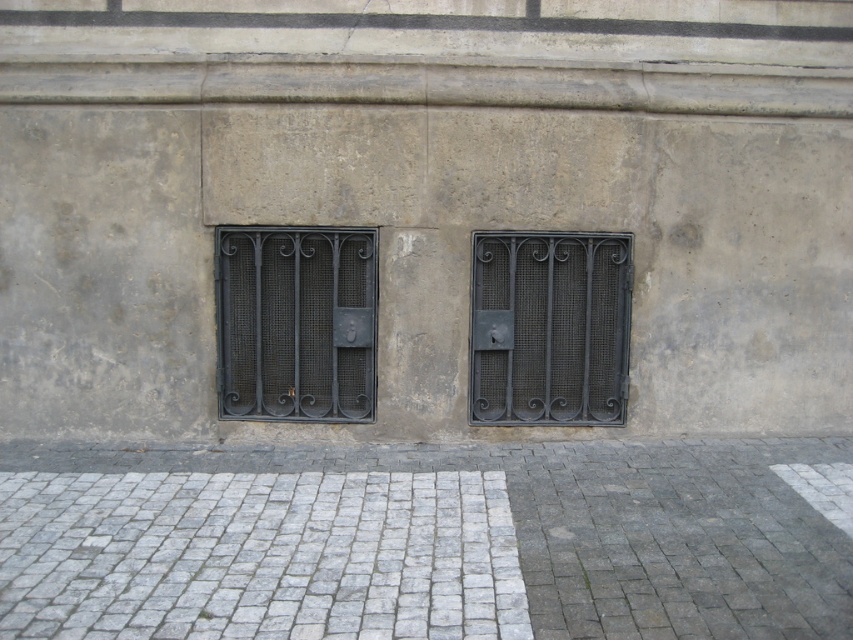
Between black wrought iron grill at center and black wrought iron window at center, which one has more height?

black wrought iron window at center

Which is behind, point (490, 420) or point (264, 349)?

Point (490, 420)

Who is more forward, (x=535, y=369) or (x=296, y=406)?

Point (x=296, y=406) is more forward.

The width and height of the screenshot is (853, 640). I want to click on black wrought iron grill at center, so click(549, 326).

Between gray cobblestone pavement at center and black wrought iron window at center, which one is positioned higher?

black wrought iron window at center is above.

Is gray cobblestone pavement at center above black wrought iron window at center?

No, gray cobblestone pavement at center is not above black wrought iron window at center.

Where is `gray cobblestone pavement at center`? Image resolution: width=853 pixels, height=640 pixels. gray cobblestone pavement at center is located at coordinates (421, 541).

Between gray cobblestone pavement at center and black wrought iron grill at center, which one is positioned higher?

black wrought iron grill at center is above.

In the scene shown: Can you confirm if gray cobblestone pavement at center is taller than black wrought iron grill at center?

Incorrect, gray cobblestone pavement at center's height is not larger of black wrought iron grill at center's.

Is point (741, 628) positioned in front of point (524, 362)?

That is True.

Where is `gray cobblestone pavement at center`? The width and height of the screenshot is (853, 640). gray cobblestone pavement at center is located at coordinates (421, 541).